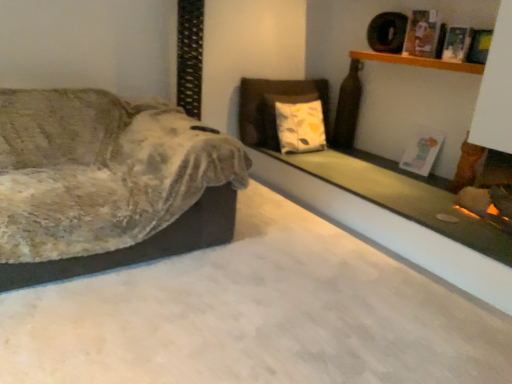
Find the location of `green matte glass at upper right`. green matte glass at upper right is located at coordinates (402, 197).

From their relative heights in the image, would you say wooden shelf at upper right is taller or shorter than green matte glass at upper right?

wooden shelf at upper right is taller than green matte glass at upper right.

From a real-world perspective, which is physically above, wooden shelf at upper right or green matte glass at upper right?

wooden shelf at upper right, from a real-world perspective.

Is wooden shelf at upper right surrounding green matte glass at upper right?

No, green matte glass at upper right is not a part of wooden shelf at upper right.

Would you say wooden shelf at upper right is to the left or to the right of green matte glass at upper right in the picture?

From the image, it's evident that wooden shelf at upper right is to the right of green matte glass at upper right.

How much distance is there between velvet fabric couch at left and green matte glass at upper right?

A distance of 4.19 feet exists between velvet fabric couch at left and green matte glass at upper right.

The width and height of the screenshot is (512, 384). I want to click on studio couch in front of the green matte glass at upper right, so click(x=106, y=183).

How many degrees apart are the facing directions of velvet fabric couch at left and green matte glass at upper right?

They differ by 90 degrees in their facing directions.

Is velvet fabric couch at left to the right of green matte glass at upper right from the viewer's perspective?

Incorrect, velvet fabric couch at left is not on the right side of green matte glass at upper right.

From a real-world perspective, who is located higher, velvet fabric couch at left or wooden shelf at upper right?

wooden shelf at upper right is physically above.

Locate an element on the screen. The width and height of the screenshot is (512, 384). studio couch below the wooden shelf at upper right (from the image's perspective) is located at coordinates (106, 183).

In terms of width, does velvet fabric couch at left look wider or thinner when compared to wooden shelf at upper right?

Clearly, velvet fabric couch at left has more width compared to wooden shelf at upper right.

From the image's perspective, is velvet fabric couch at left under wooden shelf at upper right?

Correct, velvet fabric couch at left appears lower than wooden shelf at upper right in the image.

Is green matte glass at upper right wider than velvet fabric couch at left?

No.

Is green matte glass at upper right to the left of velvet fabric couch at left from the viewer's perspective?

No, green matte glass at upper right is not to the left of velvet fabric couch at left.

Which object is further away from the camera, green matte glass at upper right or velvet fabric couch at left?

green matte glass at upper right is further away from the camera.

From the image's perspective, which one is positioned lower, green matte glass at upper right or velvet fabric couch at left?

From the image's view, green matte glass at upper right is below.

Locate an element on the screen. shelf lying on the right of velvet fabric couch at left is located at coordinates (414, 62).

Measure the distance between wooden shelf at upper right and velvet fabric couch at left.

1.94 meters.

Is wooden shelf at upper right outside of velvet fabric couch at left?

Yes.

Based on the photo, between wooden shelf at upper right and velvet fabric couch at left, which one has smaller width?

With smaller width is wooden shelf at upper right.

Does green matte glass at upper right turn towards wooden shelf at upper right?

No.

Considering the positions of points (494, 254) and (444, 63), is point (494, 254) farther from camera compared to point (444, 63)?

No, it is not.

Is green matte glass at upper right situated inside wooden shelf at upper right or outside?

green matte glass at upper right is located beyond the bounds of wooden shelf at upper right.

Considering the sizes of objects green matte glass at upper right and wooden shelf at upper right in the image provided, who is bigger, green matte glass at upper right or wooden shelf at upper right?

With larger size is green matte glass at upper right.

This screenshot has height=384, width=512. I want to click on shelf on the right of the green matte glass at upper right, so click(414, 62).

Where is `ledge below the velvet fabric couch at left (from the image's perspective)`? ledge below the velvet fabric couch at left (from the image's perspective) is located at coordinates (402, 197).

From the image, which object appears to be nearer to green matte glass at upper right, velvet fabric couch at left or wooden shelf at upper right?

wooden shelf at upper right.

When comparing their distances from wooden shelf at upper right, does velvet fabric couch at left or green matte glass at upper right seem further?

velvet fabric couch at left is further to wooden shelf at upper right.

Looking at the image, which one is located closer to wooden shelf at upper right, green matte glass at upper right or velvet fabric couch at left?

green matte glass at upper right lies closer to wooden shelf at upper right than the other object.

Looking at the image, which one is located further to velvet fabric couch at left, green matte glass at upper right or wooden shelf at upper right?

wooden shelf at upper right lies further to velvet fabric couch at left than the other object.

Based on their spatial positions, is wooden shelf at upper right or green matte glass at upper right further from velvet fabric couch at left?

wooden shelf at upper right.

Based on their spatial positions, is wooden shelf at upper right or velvet fabric couch at left further from green matte glass at upper right?

velvet fabric couch at left.

Find the location of `ledge located between velvet fabric couch at left and wooden shelf at upper right in the left-right direction`. ledge located between velvet fabric couch at left and wooden shelf at upper right in the left-right direction is located at coordinates (402, 197).